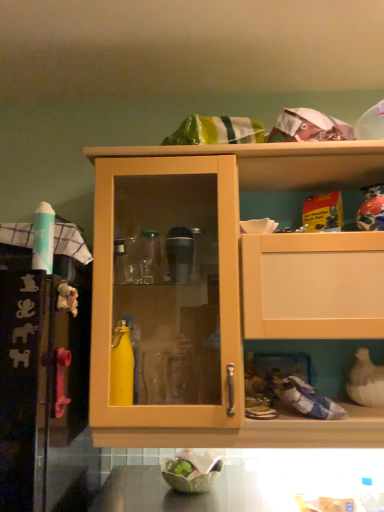
Question: From the image's perspective, is smooth dark brown countertop at lower center above or below green leafy material bowl at lower center?

Choices:
 (A) above
 (B) below

Answer: (B)

Question: From a real-world perspective, relative to green leafy material bowl at lower center, is smooth dark brown countertop at lower center vertically above or below?

Choices:
 (A) above
 (B) below

Answer: (B)

Question: Estimate the real-world distances between objects in this image. Which object is closer to the green leafy material bowl at lower center?

Choices:
 (A) smooth dark brown countertop at lower center
 (B) matte wood cabinet at center

Answer: (A)

Question: Estimate the real-world distances between objects in this image. Which object is closer to the green leafy material bowl at lower center?

Choices:
 (A) smooth dark brown countertop at lower center
 (B) matte wood cabinet at center

Answer: (A)